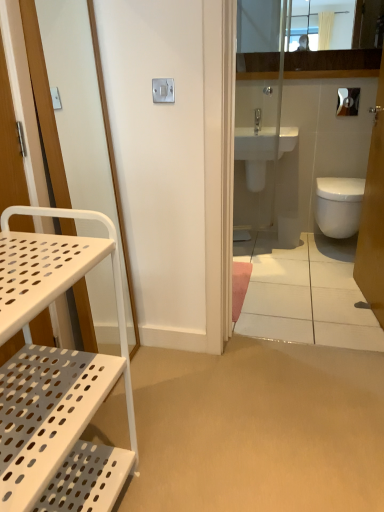
Where is `unoccupied area behind white glossy screen door at upper right, arranged as the 2th screen door when viewed from the left`? unoccupied area behind white glossy screen door at upper right, arranged as the 2th screen door when viewed from the left is located at coordinates (309, 271).